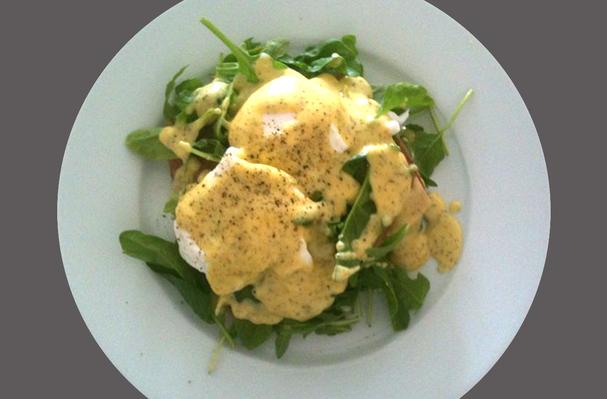
The image size is (607, 399). Find the location of `edge of plate`. edge of plate is located at coordinates (385, 383).